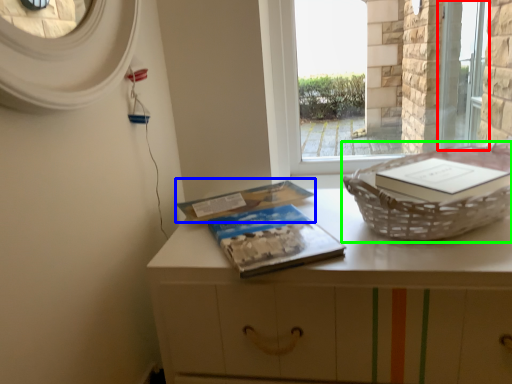
Question: Which object is the farthest from screen door (highlighted by a red box)? Choose among these: paperback book (highlighted by a blue box) or basket container (highlighted by a green box).

Choices:
 (A) paperback book
 (B) basket container

Answer: (A)